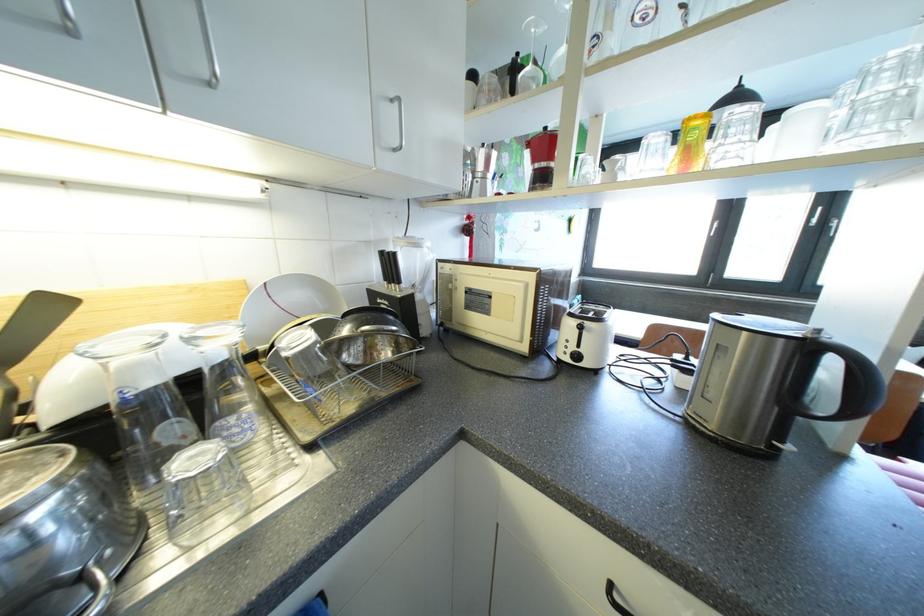
Describe the element at coordinates (576, 357) in the screenshot. This screenshot has width=924, height=616. I see `the white toaster dial` at that location.